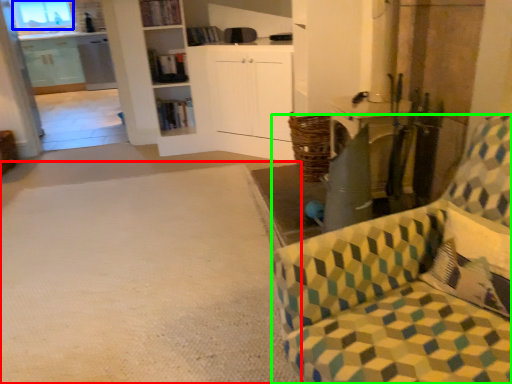
Question: Based on their relative distances, which object is farther from plain (highlighted by a red box)? Choose from window (highlighted by a blue box) and chair (highlighted by a green box).

Choices:
 (A) window
 (B) chair

Answer: (A)